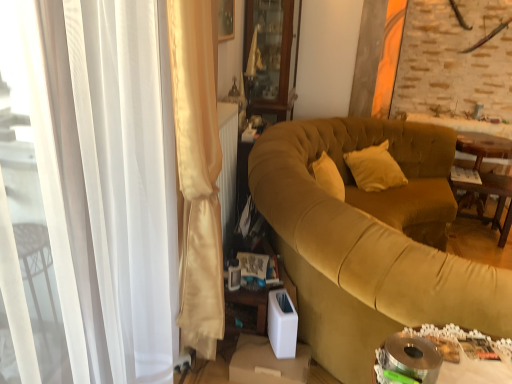
Question: Considering the relative positions of satin white curtain at left and metallic silver tray at lower right, positioned as the first table in front-to-back order, in the image provided, is satin white curtain at left to the left or to the right of metallic silver tray at lower right, positioned as the first table in front-to-back order,?

Choices:
 (A) left
 (B) right

Answer: (A)

Question: In terms of size, does satin white curtain at left appear bigger or smaller than metallic silver tray at lower right, marked as the third table in a right-to-left arrangement?

Choices:
 (A) small
 (B) big

Answer: (B)

Question: Considering the real-world distances, which object is closest to the wooden table at right, marked as the 2th table in a front-to-back arrangement?

Choices:
 (A) satin white curtain at left
 (B) velvet mustard couch at center
 (C) wooden cabinet at upper center
 (D) metallic silver tray at lower right, marked as the third table in a right-to-left arrangement
 (E) wooden table at right, the third table positioned from the left

Answer: (E)

Question: Which object is the closest to the satin white curtain at left?

Choices:
 (A) wooden table at right, which is the 2th table in right-to-left order
 (B) metallic silver tray at lower right, positioned as the first table in front-to-back order
 (C) velvet mustard couch at center
 (D) wooden cabinet at upper center
 (E) wooden table at right, acting as the first table starting from the right

Answer: (B)